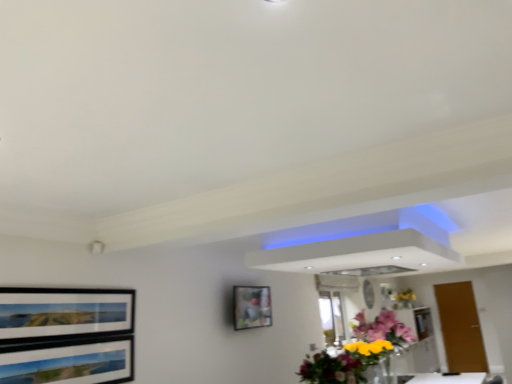
Question: Does point (334, 370) appear closer or farther from the camera than point (441, 294)?

Choices:
 (A) closer
 (B) farther

Answer: (A)

Question: From a real-world perspective, is glossy floral bouquet at center positioned above or below brown matte door at right?

Choices:
 (A) above
 (B) below

Answer: (A)

Question: Based on their relative distances, which object is farther from the glossy floral bouquet at center?

Choices:
 (A) translucent glass vase at upper right, which appears as the second flower when viewed from the front
 (B) matte black picture frame at center
 (C) vibrant floral bouquet at center, the first flower in the top-to-bottom sequence
 (D) brown matte door at right

Answer: (A)

Question: Which object is the closest to the matte black picture frame at center?

Choices:
 (A) vibrant floral bouquet at center, the second flower in the right-to-left sequence
 (B) translucent glass vase at upper right, the 1th flower in the bottom-to-top sequence
 (C) glossy floral bouquet at center
 (D) brown matte door at right

Answer: (A)